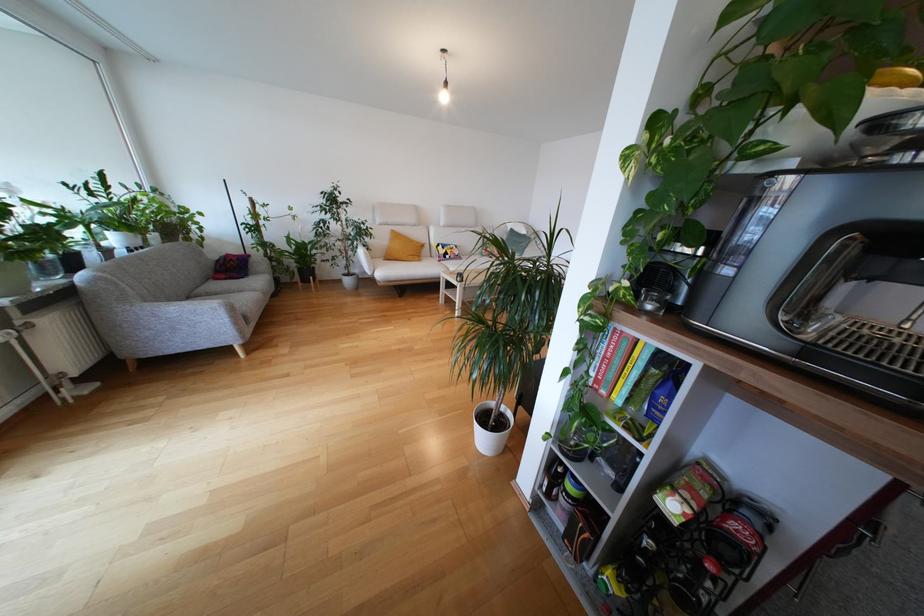
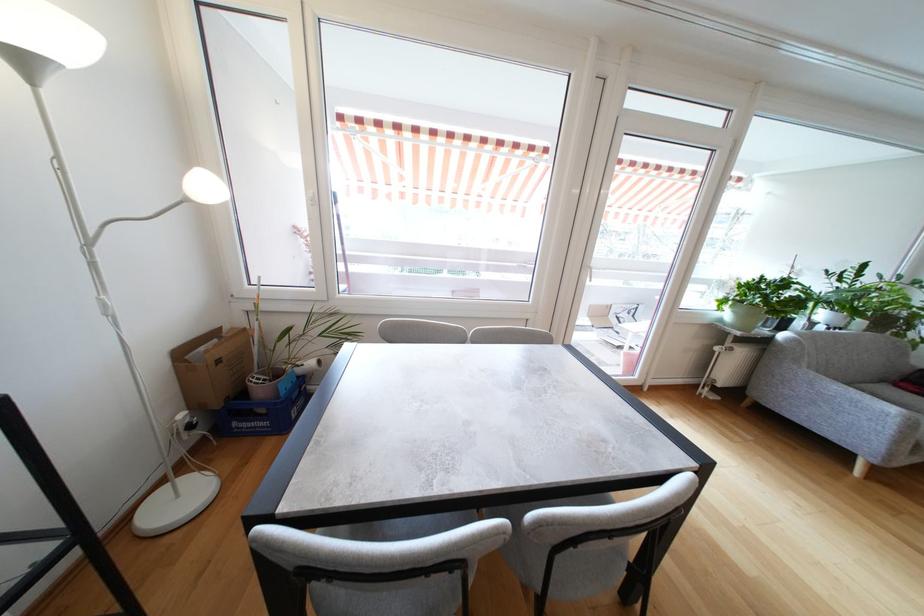
The point at (x=84, y=306) is marked in the first image. Where is the corresponding point in the second image?

(768, 352)